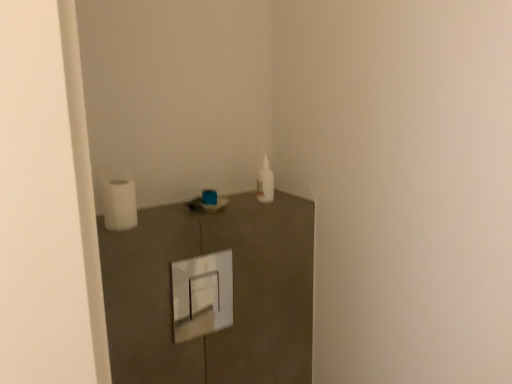
Question: From a real-world perspective, is matte plastic sink at center physically located above or below white matte toilet paper at left?

Choices:
 (A) above
 (B) below

Answer: (B)

Question: Is matte plastic sink at center wider or thinner than white matte toilet paper at left?

Choices:
 (A) thin
 (B) wide

Answer: (B)

Question: Considering their positions, is matte plastic sink at center located in front of or behind white matte toilet paper at left?

Choices:
 (A) behind
 (B) front

Answer: (A)

Question: Considering their positions, is white matte toilet paper at left located in front of or behind matte plastic sink at center?

Choices:
 (A) front
 (B) behind

Answer: (A)

Question: From their relative heights in the image, would you say white matte toilet paper at left is taller or shorter than matte plastic sink at center?

Choices:
 (A) short
 (B) tall

Answer: (B)

Question: Does point (126, 226) appear closer or farther from the camera than point (214, 201)?

Choices:
 (A) farther
 (B) closer

Answer: (B)

Question: From the image's perspective, is white matte toilet paper at left located above or below matte plastic sink at center?

Choices:
 (A) below
 (B) above

Answer: (B)